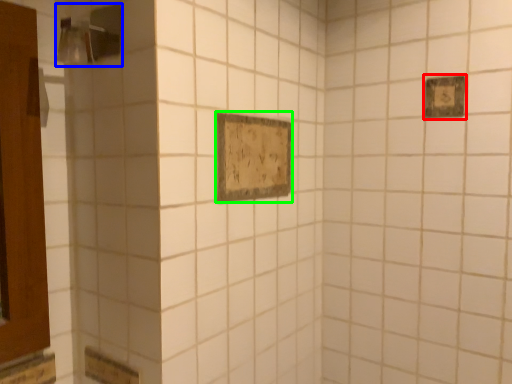
Question: Estimate the real-world distances between objects in this image. Which object is farther from rectangle (highlighted by a red box), shower (highlighted by a blue box) or rectangle (highlighted by a green box)?

Choices:
 (A) shower
 (B) rectangle

Answer: (A)